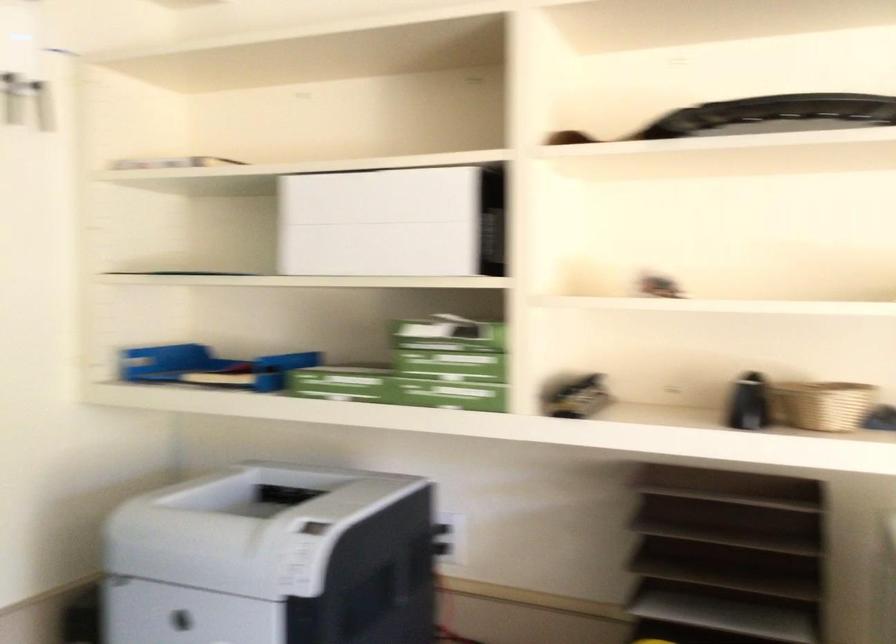
The location [822,404] corresponds to which object?

This point indicates the wicker basket.